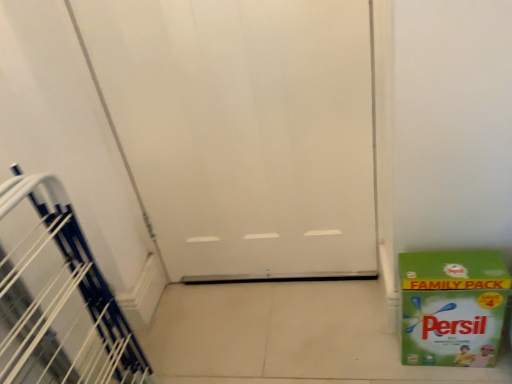
What do you see at coordinates (57, 295) in the screenshot? I see `white plastic stairwell at left` at bounding box center [57, 295].

I want to click on green paper box at lower right, so click(x=452, y=307).

Image resolution: width=512 pixels, height=384 pixels. What do you see at coordinates (452, 307) in the screenshot?
I see `green paper box at lower right` at bounding box center [452, 307].

What do you see at coordinates (244, 131) in the screenshot? The image size is (512, 384). I see `white matte door at center` at bounding box center [244, 131].

Locate an element on the screen. white plastic stairwell at left is located at coordinates (57, 295).

Which object is further away from the camera taking this photo, white plastic stairwell at left or white matte door at center?

white matte door at center is more distant.

From the picture: Who is bigger, white plastic stairwell at left or white matte door at center?

white matte door at center.

Between white plastic stairwell at left and white matte door at center, which one appears on the left side from the viewer's perspective?

white plastic stairwell at left is more to the left.

From a real-world perspective, is white plastic stairwell at left physically located above or below white matte door at center?

Clearly, from a real-world perspective, white plastic stairwell at left is below white matte door at center.

Is green paper box at lower right surrounded by white plastic stairwell at left?

No, green paper box at lower right is not surrounded by white plastic stairwell at left.

Considering the sizes of objects white plastic stairwell at left and green paper box at lower right in the image provided, who is bigger, white plastic stairwell at left or green paper box at lower right?

white plastic stairwell at left.

Which object is wider, white plastic stairwell at left or green paper box at lower right?

white plastic stairwell at left.

Is white matte door at center not near white plastic stairwell at left?

No, white matte door at center is not far from white plastic stairwell at left.

From the image's perspective, between white matte door at center and white plastic stairwell at left, who is located below?

white plastic stairwell at left.

In the scene shown: From a real-world perspective, is green paper box at lower right physically above white plastic stairwell at left?

No, from a real-world perspective, green paper box at lower right is not above white plastic stairwell at left.

Is green paper box at lower right positioned behind white plastic stairwell at left?

Yes, the depth of green paper box at lower right is greater than that of white plastic stairwell at left.

Considering the sizes of objects green paper box at lower right and white plastic stairwell at left in the image provided, who is wider, green paper box at lower right or white plastic stairwell at left?

Wider between the two is white plastic stairwell at left.

From the image's perspective, which is above, green paper box at lower right or white plastic stairwell at left?

From the image's view, green paper box at lower right is above.

Looking at this image, can you confirm if white matte door at center is taller than green paper box at lower right?

Correct, white matte door at center is much taller as green paper box at lower right.

Which object is closer to the camera, white matte door at center or green paper box at lower right?

white matte door at center is closer to the camera.

The image size is (512, 384). Find the location of `door located in front of the green paper box at lower right`. door located in front of the green paper box at lower right is located at coordinates (244, 131).

How many degrees apart are the facing directions of white matte door at center and green paper box at lower right?

2.08 degrees separate the facing orientations of white matte door at center and green paper box at lower right.

Is green paper box at lower right with white matte door at center?

No.

Considering the positions of objects green paper box at lower right and white matte door at center in the image provided, who is more to the left, green paper box at lower right or white matte door at center?

white matte door at center.

Is white matte door at center completely or partially inside green paper box at lower right?

That's incorrect, white matte door at center is not inside green paper box at lower right.

In the image, is green paper box at lower right positioned in front of or behind white matte door at center?

Visually, green paper box at lower right is located behind white matte door at center.

Locate an element on the screen. The height and width of the screenshot is (384, 512). door that appears behind the white plastic stairwell at left is located at coordinates (244, 131).

Find the location of a particular element. The height and width of the screenshot is (384, 512). stairwell above the green paper box at lower right (from a real-world perspective) is located at coordinates (57, 295).

When comparing their distances from white plastic stairwell at left, does green paper box at lower right or white matte door at center seem closer?

Among the two, white matte door at center is located nearer to white plastic stairwell at left.

Estimate the real-world distances between objects in this image. Which object is closer to green paper box at lower right, white matte door at center or white plastic stairwell at left?

white matte door at center.

Consider the image. Based on their spatial positions, is white plastic stairwell at left or white matte door at center further from green paper box at lower right?

Based on the image, white plastic stairwell at left appears to be further to green paper box at lower right.

From the image, which object appears to be farther from white matte door at center, white plastic stairwell at left or green paper box at lower right?

white plastic stairwell at left is further to white matte door at center.

Based on their spatial positions, is green paper box at lower right or white plastic stairwell at left further from white matte door at center?

white plastic stairwell at left lies further to white matte door at center than the other object.

When comparing their distances from white plastic stairwell at left, does white matte door at center or green paper box at lower right seem further?

green paper box at lower right is further to white plastic stairwell at left.

At what (x,y) coordinates should I click in order to perform the action: click on door between white plastic stairwell at left and green paper box at lower right in the horizontal direction. Please return your answer as a coordinate pair (x, y). The width and height of the screenshot is (512, 384). Looking at the image, I should click on (244, 131).